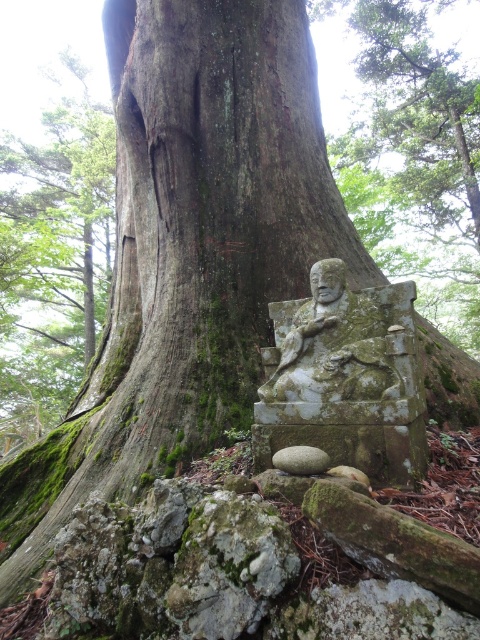
Is green mossy stone statue at lower center below green mossy bark at lower left?

Actually, green mossy stone statue at lower center is above green mossy bark at lower left.

Which is below, green mossy stone statue at lower center or green mossy bark at lower left?

Positioned lower is green mossy bark at lower left.

Does point (458, 208) come in front of point (36, 372)?

No, it is not.

Identify the location of green mossy stone statue at lower center. (411, 152).

Find the location of a particular element. Image resolution: width=480 pixels, height=640 pixels. green mossy stone statue at lower center is located at coordinates (411, 152).

Where is `green mossy stone statue at lower center`? The height and width of the screenshot is (640, 480). green mossy stone statue at lower center is located at coordinates (411, 152).

Locate an element on the screen. green mossy stone statue at lower center is located at coordinates (411, 152).

Which of these two, green mossy stone statue at lower center or green mossy stone statue at center, stands taller?

green mossy stone statue at lower center

Is point (432, 257) farther from camera compared to point (287, 333)?

Yes, it is.

Image resolution: width=480 pixels, height=640 pixels. What do you see at coordinates (411, 152) in the screenshot?
I see `green mossy stone statue at lower center` at bounding box center [411, 152].

This screenshot has width=480, height=640. What are the coordinates of `green mossy stone statue at lower center` in the screenshot? It's located at (411, 152).